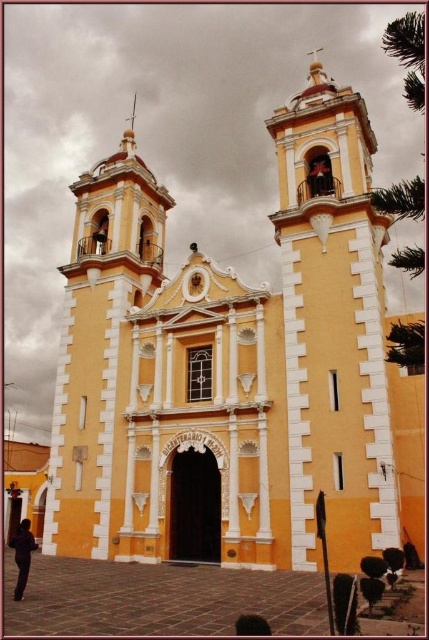
You are standing in front of the yellow matte church at center and want to walk to the smooth orange bell tower at right. Which direction should you face to move towards it?

The yellow matte church at center is to the left of the smooth orange bell tower at right, so you should face to the right to move towards it.